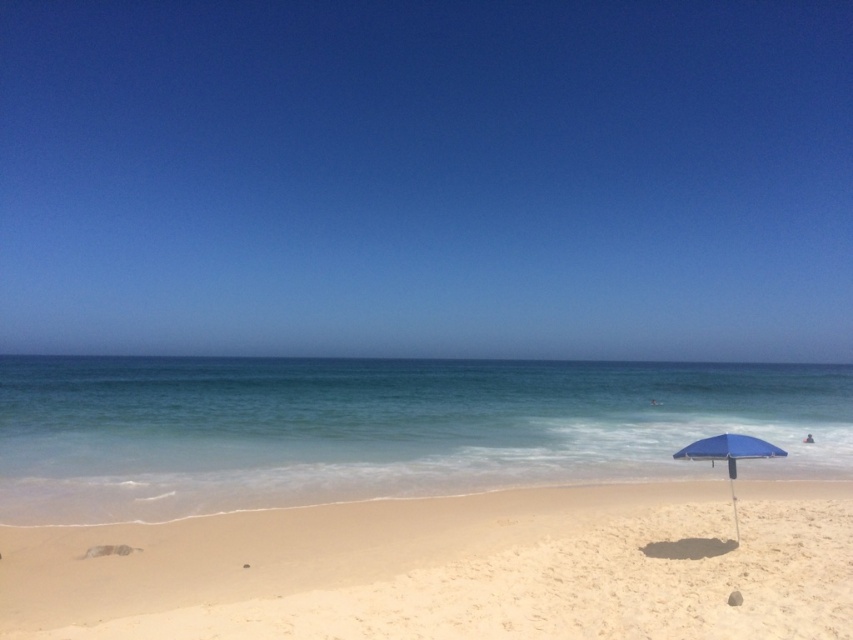
Which of these two, light beige sand at lower center or blue fabric umbrella at lower right, stands taller?

Standing taller between the two is light beige sand at lower center.

Is light beige sand at lower center positioned before blue fabric umbrella at lower right?

Yes.

This screenshot has height=640, width=853. Find the location of `light beige sand at lower center`. light beige sand at lower center is located at coordinates (453, 568).

This screenshot has width=853, height=640. I want to click on light beige sand at lower center, so click(453, 568).

Consider the image. Can you confirm if clear blue water at center is wider than blue fabric umbrella at lower right?

Indeed, clear blue water at center has a greater width compared to blue fabric umbrella at lower right.

Does point (463, 417) lie in front of point (720, 449)?

No, (463, 417) is further to viewer.

You are a GUI agent. You are given a task and a screenshot of the screen. Output one action in this format:
    pyautogui.click(x=<x>, y=<y>)
    Task: Click on the clear blue water at center
    The width and height of the screenshot is (853, 640).
    Given the screenshot: What is the action you would take?
    pyautogui.click(x=381, y=428)

Between light beige sand at lower center and clear blue water at center, which one appears on the left side from the viewer's perspective?

From the viewer's perspective, light beige sand at lower center appears more on the left side.

Does point (781, 536) lie in front of point (479, 388)?

That is True.

Is point (759, 580) more distant than point (97, 509)?

No.

You are a GUI agent. You are given a task and a screenshot of the screen. Output one action in this format:
    pyautogui.click(x=<x>, y=<y>)
    Task: Click on the light beige sand at lower center
    
    Given the screenshot: What is the action you would take?
    pyautogui.click(x=453, y=568)